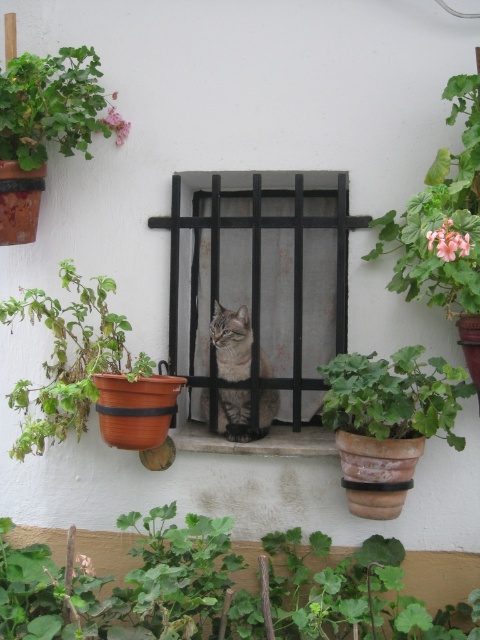
You are a delivery robot that is 24 inches wide. You need to move from the green matte pot at right to the gray tabby cat at center. Is there enough space between them for you to pass through?

The distance between the green matte pot at right and the gray tabby cat at center is 23.99 inches, which is slightly less than the robot width of 24 inches. Therefore, the robot cannot pass through the space between them.

You are a gardener looking at the image. You want to place a new plant pot exactly where the green leafy plant at upper right is currently located. What are the coordinates you should input into your gardening app to mark this spot?

The coordinates for the green leafy plant at upper right are at point (442, 220), so you should input those into your gardening app to mark the spot.

You are a gardener who wants to water the green leafy plant at upper right. The watering can is placed at point [442,220]. Can you reach the plant from the watering can location?

The point [442,220] marks the green leafy plant at upper right, so yes, you can reach the plant directly from the watering can location as it is exactly at that point.